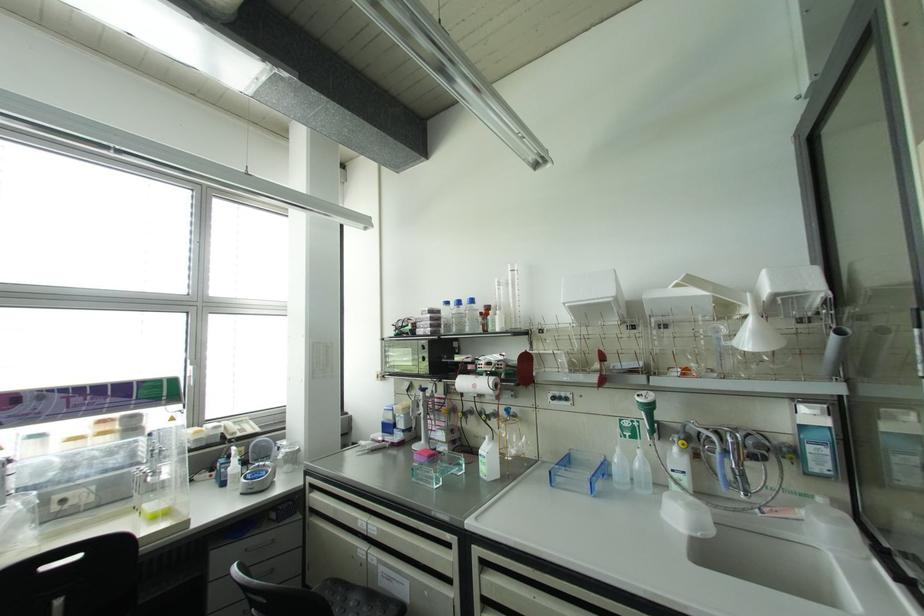
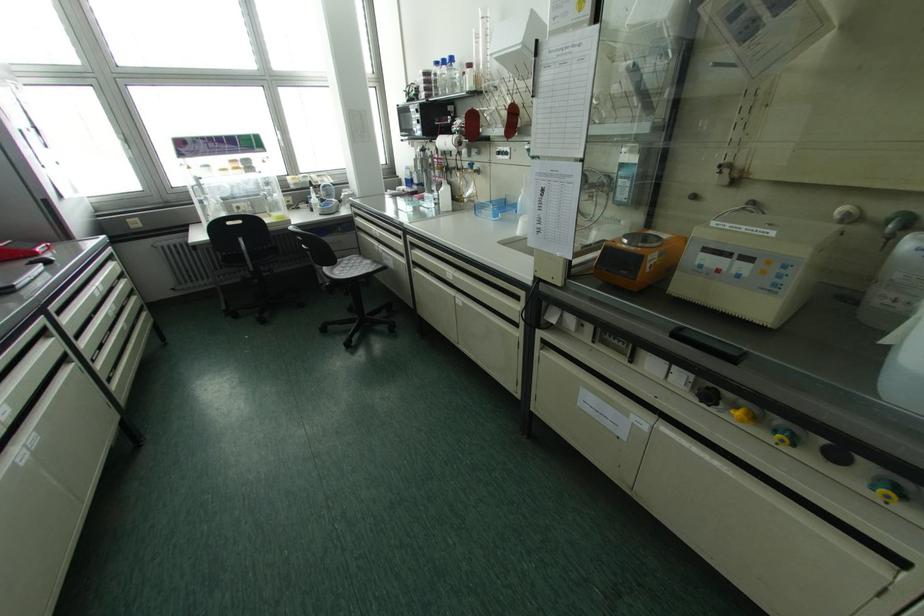
Where in the second image is the point corresponding to (446,302) from the first image?

(435, 63)